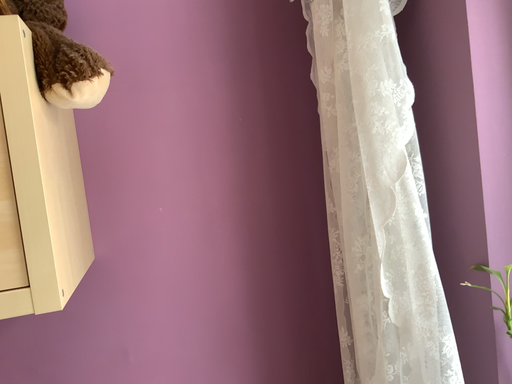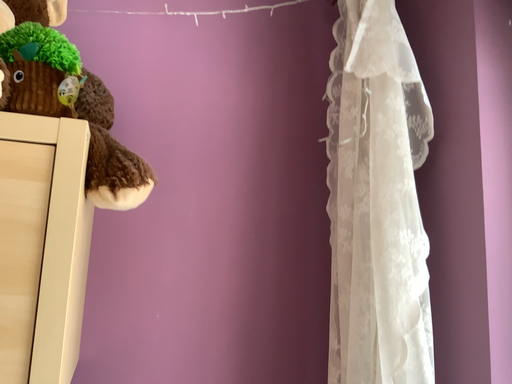
Question: How did the camera likely rotate when shooting the video?

Choices:
 (A) rotated upward
 (B) rotated downward

Answer: (A)